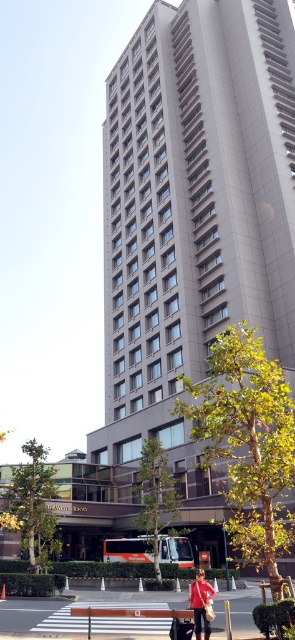
Does gray concrete building at center have a lesser width compared to matte red jacket at center?

No, gray concrete building at center is not thinner than matte red jacket at center.

This screenshot has width=295, height=640. What do you see at coordinates (194, 209) in the screenshot? I see `gray concrete building at center` at bounding box center [194, 209].

Is point (151, 432) more distant than point (202, 595)?

Yes, it is behind point (202, 595).

Image resolution: width=295 pixels, height=640 pixels. What are the coordinates of `gray concrete building at center` in the screenshot? It's located at (194, 209).

Does point (241, 627) come behind point (197, 625)?

Yes, it is.

Does point (40, 605) come in front of point (207, 589)?

No, it is behind (207, 589).

Is point (253, 602) positioned behind point (205, 592)?

Yes, point (253, 602) is behind point (205, 592).

At what (x,y) coordinates should I click in order to perform the action: click on smooth asphalt pavement at lower center. Please return your answer as a coordinate pair (x, y). The image size is (295, 640). Looking at the image, I should click on (69, 611).

Is gray concrete building at center taller than smooth asphalt pavement at lower center?

Correct, gray concrete building at center is much taller as smooth asphalt pavement at lower center.

How distant is gray concrete building at center from smooth asphalt pavement at lower center?

gray concrete building at center and smooth asphalt pavement at lower center are 32.40 meters apart from each other.

The height and width of the screenshot is (640, 295). What do you see at coordinates (194, 209) in the screenshot? I see `gray concrete building at center` at bounding box center [194, 209].

Where is `gray concrete building at center`? gray concrete building at center is located at coordinates (194, 209).